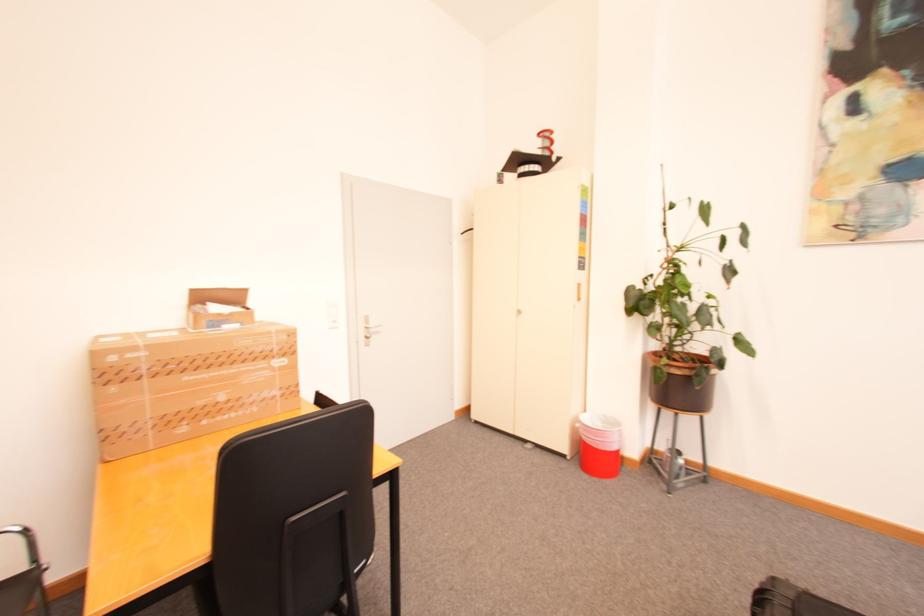
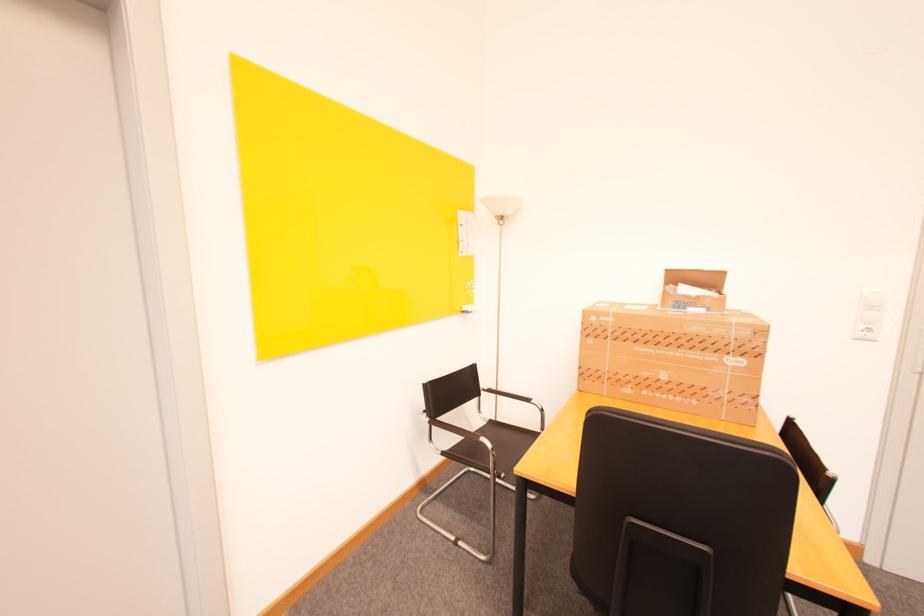
Where in the second image is the point corresponding to (x=193, y=379) from the first image?

(643, 349)